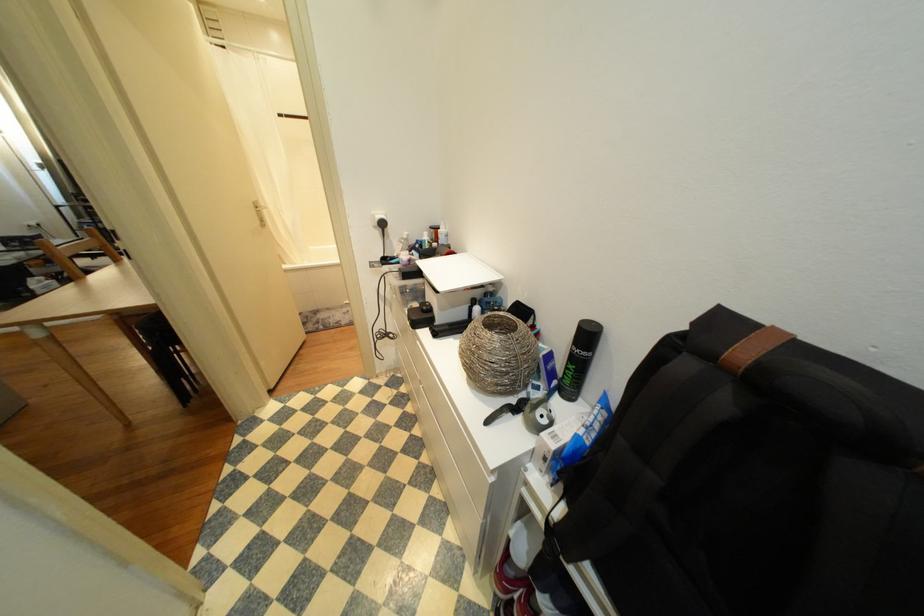
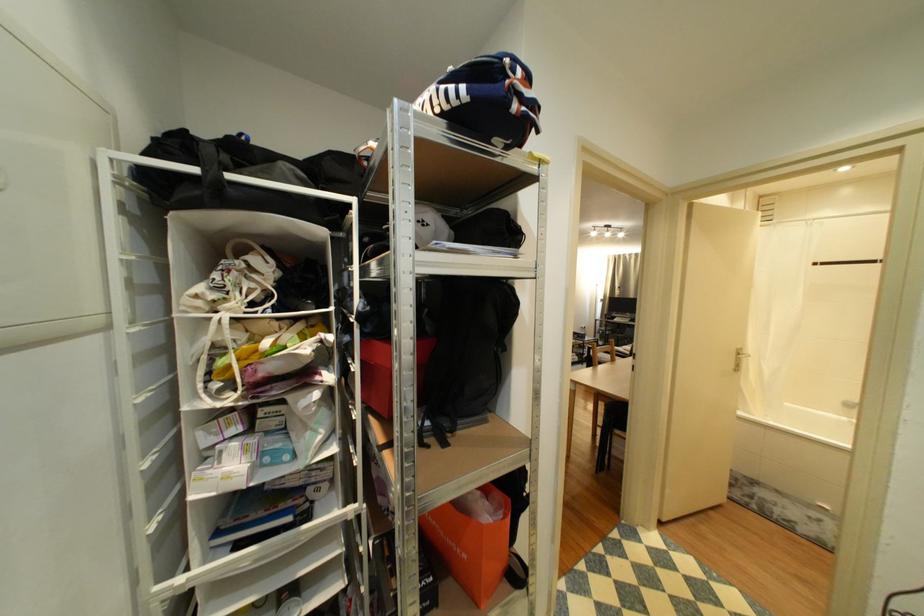
Question: The camera is either moving clockwise (left) or counter-clockwise (right) around the object. The first image is from the beginning of the video and the second image is from the end. Is the camera moving left or right when shooting the video?

Choices:
 (A) Left
 (B) Right

Answer: (B)